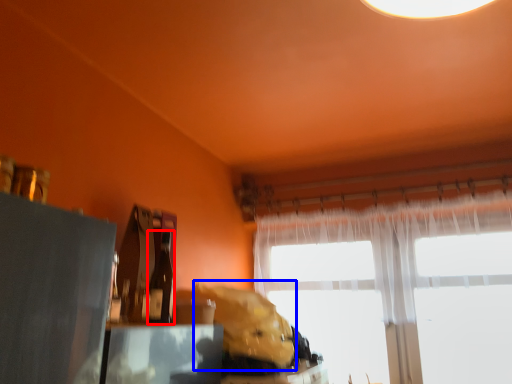
Question: Which object appears farthest to the camera in this image, bottle (highlighted by a red box) or animal (highlighted by a blue box)?

Choices:
 (A) bottle
 (B) animal

Answer: (B)